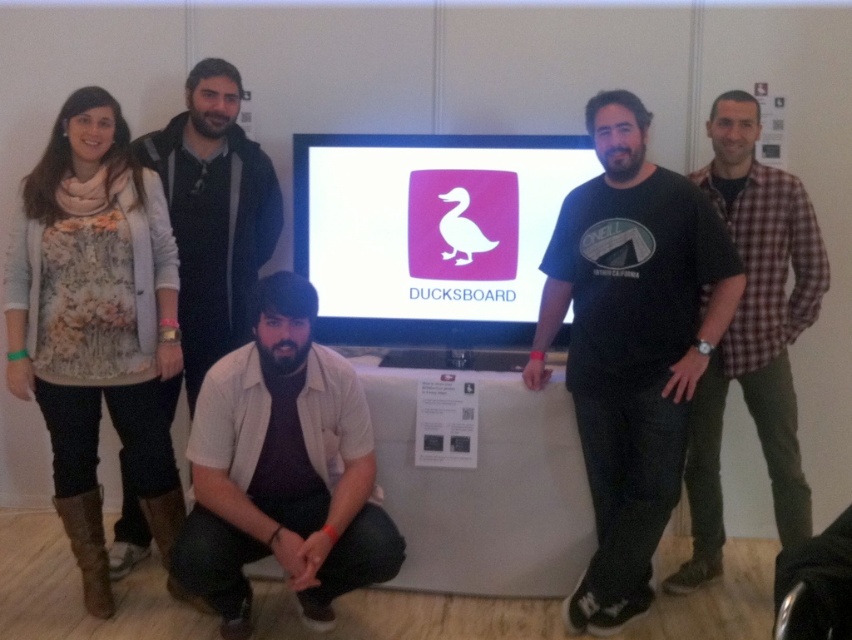
Question: Which of the following is the closest to the observer?

Choices:
 (A) tap(712, 385)
 (B) tap(630, 397)

Answer: (B)

Question: Can you confirm if floral fabric top at left is positioned below matte black jacket at left?

Choices:
 (A) no
 (B) yes

Answer: (B)

Question: Does beige cotton shirt at lower center appear under matte black jacket at left?

Choices:
 (A) no
 (B) yes

Answer: (B)

Question: Among these objects, which one is farthest from the camera?

Choices:
 (A) beige cotton shirt at lower center
 (B) plaid shirt at right
 (C) matte black jacket at left

Answer: (C)

Question: Which object appears closest to the camera in this image?

Choices:
 (A) black cotton t-shirt at center
 (B) beige cotton shirt at lower center
 (C) white glossy screen at center
 (D) plaid shirt at right

Answer: (B)

Question: Considering the relative positions of floral fabric top at left and matte black jacket at left in the image provided, where is floral fabric top at left located with respect to matte black jacket at left?

Choices:
 (A) above
 (B) below

Answer: (B)